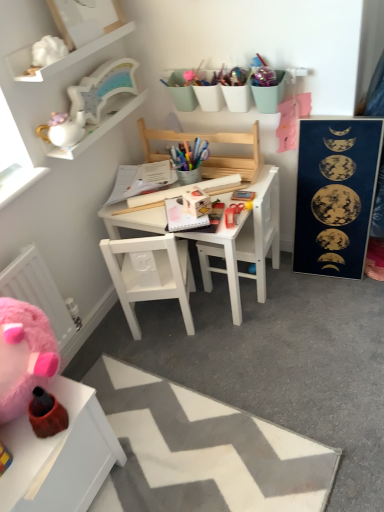
Locate an element on the screen. This screenshot has width=384, height=512. vacant space that is to the left of white matte chair at center, acting as the 2th chair starting from the top is located at coordinates (115, 333).